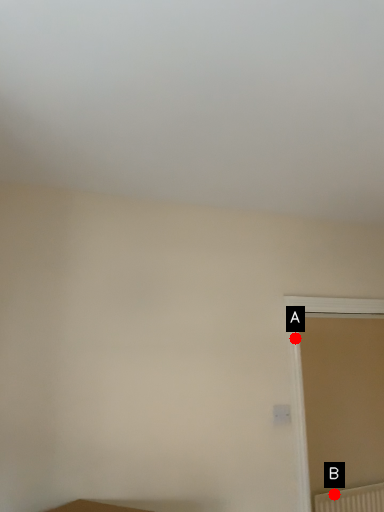
Question: Two points are circled on the image, labeled by A and B beside each circle. Among these points, which one is nearest to the camera?

Choices:
 (A) A is closer
 (B) B is closer

Answer: (A)